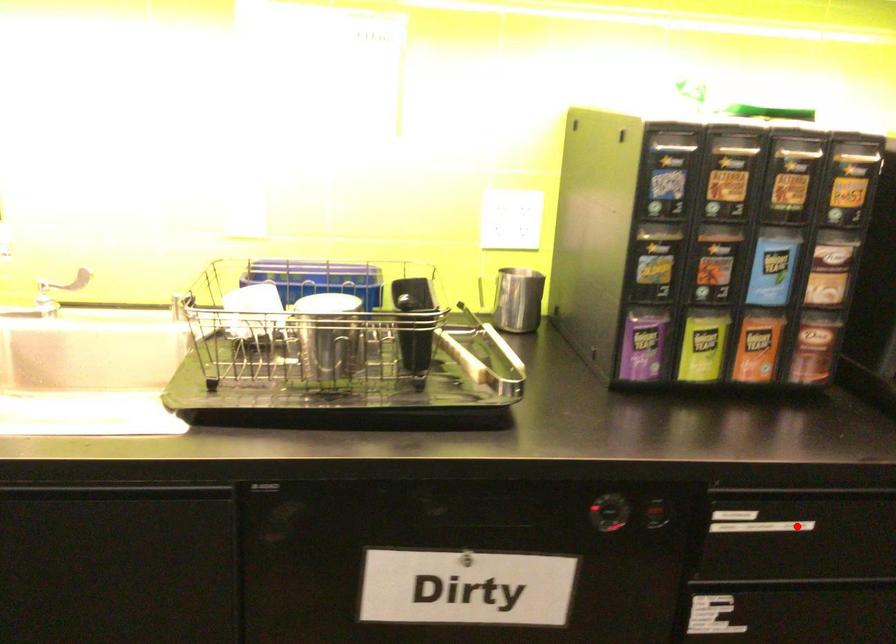
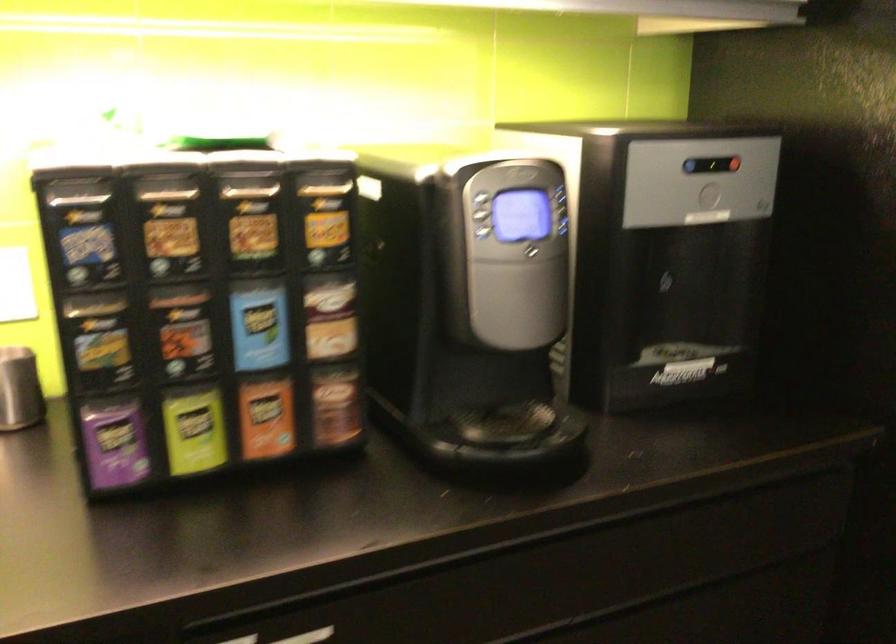
Find the pixel in the second image that matches the highlighted location in the first image.

(308, 636)